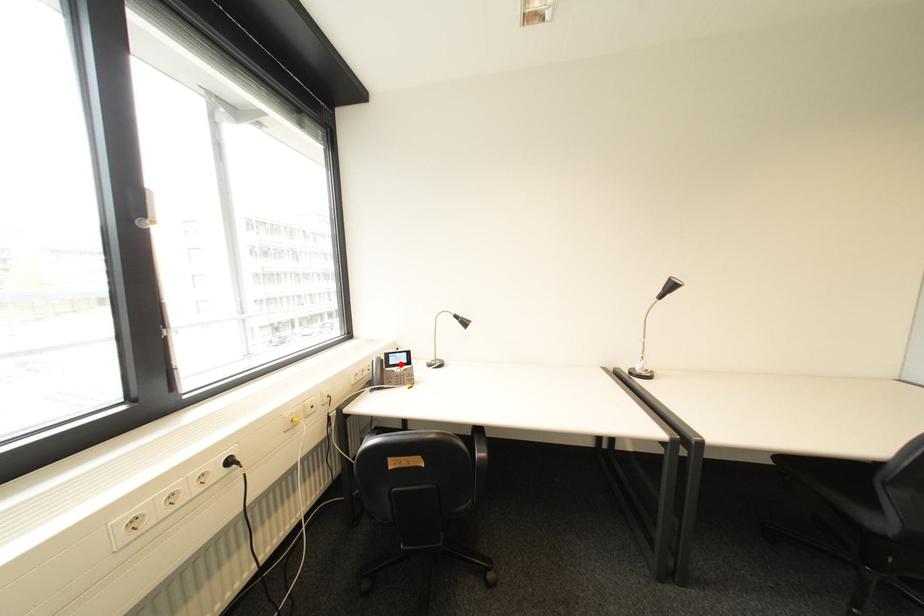
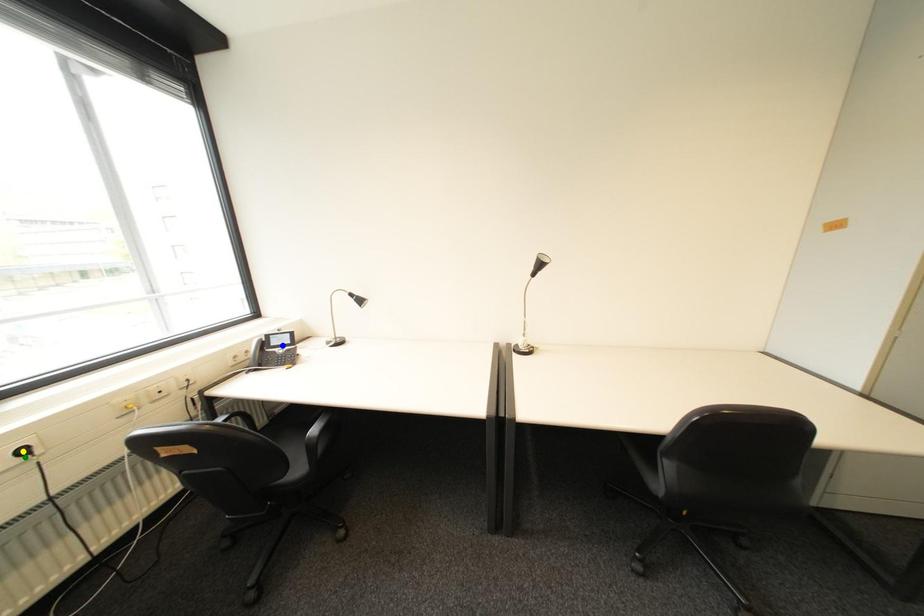
Question: I am providing you with two images of the same scene from different viewpoints. A red point is marked on the first image. You are given multiple points on the second image. Which point in image 2 represents the same 3d spot as the red point in image 1?

Choices:
 (A) blue point
 (B) yellow point
 (C) green point

Answer: (A)